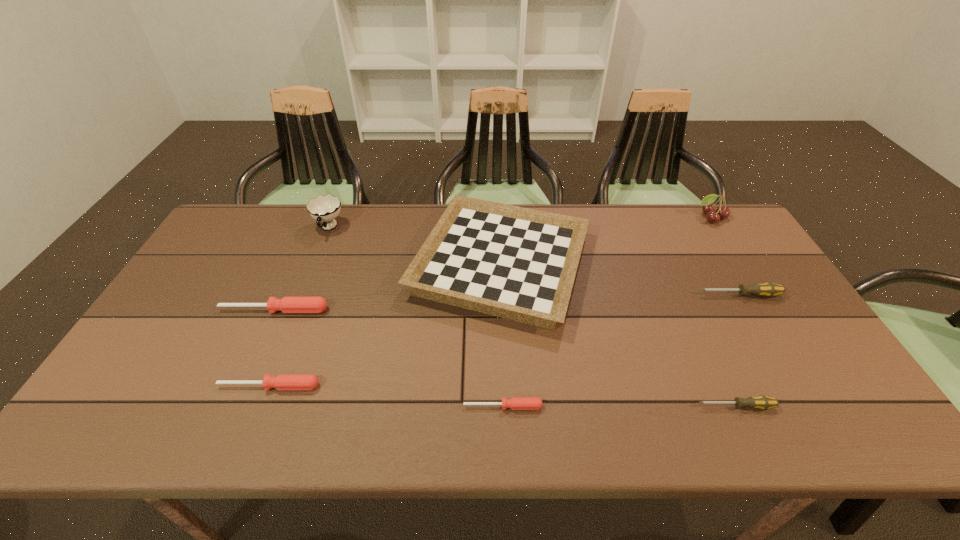
Locate an element on the screen. red cherry is located at coordinates (708, 208).

At what (x,y) coordinates should I click in order to perform the action: click on cup. Please return your answer as a coordinate pair (x, y). Looking at the image, I should click on (324, 208).

Image resolution: width=960 pixels, height=540 pixels. What are the coordinates of `checkerboard` in the screenshot? It's located at (512, 262).

Locate an element on the screen. This screenshot has height=540, width=960. the bigger gray screwdriver is located at coordinates (768, 289).

Identify the location of the farther gray screwdriver. The height and width of the screenshot is (540, 960). (x=768, y=289).

The width and height of the screenshot is (960, 540). Identify the location of the fourth nearest screwdriver. (287, 304).

This screenshot has height=540, width=960. What are the coordinates of `the biggest red screwdriver` in the screenshot? It's located at (287, 304).

Locate an element on the screen. the third farthest screwdriver is located at coordinates (283, 381).

Image resolution: width=960 pixels, height=540 pixels. Find the location of `the sixth farthest object`. the sixth farthest object is located at coordinates (283, 381).

Locate an element on the screen. the nearer gray screwdriver is located at coordinates (762, 402).